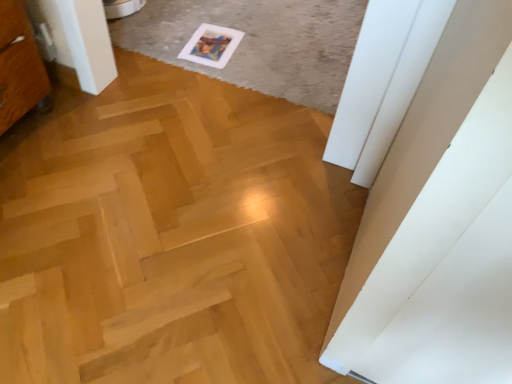
Question: From the image's perspective, does natural wood plywood at center appear lower than white paper at upper center?

Choices:
 (A) no
 (B) yes

Answer: (B)

Question: Can you confirm if natural wood plywood at center is positioned to the right of white paper at upper center?

Choices:
 (A) no
 (B) yes

Answer: (A)

Question: Is natural wood plywood at center aimed at white paper at upper center?

Choices:
 (A) yes
 (B) no

Answer: (A)

Question: Is natural wood plywood at center not close to white paper at upper center?

Choices:
 (A) yes
 (B) no

Answer: (B)

Question: From a real-world perspective, is natural wood plywood at center below white paper at upper center?

Choices:
 (A) no
 (B) yes

Answer: (B)

Question: Is white paper at upper center a part of natural wood plywood at center?

Choices:
 (A) yes
 (B) no

Answer: (B)

Question: Would you say white paper at upper center is outside white paper postcard at upper center?

Choices:
 (A) no
 (B) yes

Answer: (B)

Question: From the image's perspective, does white paper at upper center appear lower than white paper postcard at upper center?

Choices:
 (A) yes
 (B) no

Answer: (B)

Question: Considering the relative sizes of white paper at upper center and white paper postcard at upper center in the image provided, is white paper at upper center bigger than white paper postcard at upper center?

Choices:
 (A) no
 (B) yes

Answer: (B)

Question: Is white paper at upper center smaller than white paper postcard at upper center?

Choices:
 (A) yes
 (B) no

Answer: (B)

Question: From the image's perspective, is white paper at upper center located above white paper postcard at upper center?

Choices:
 (A) no
 (B) yes

Answer: (B)

Question: Is white paper postcard at upper center located within white paper at upper center?

Choices:
 (A) no
 (B) yes

Answer: (B)

Question: From the image's perspective, does white paper postcard at upper center appear higher than natural wood plywood at center?

Choices:
 (A) no
 (B) yes

Answer: (B)